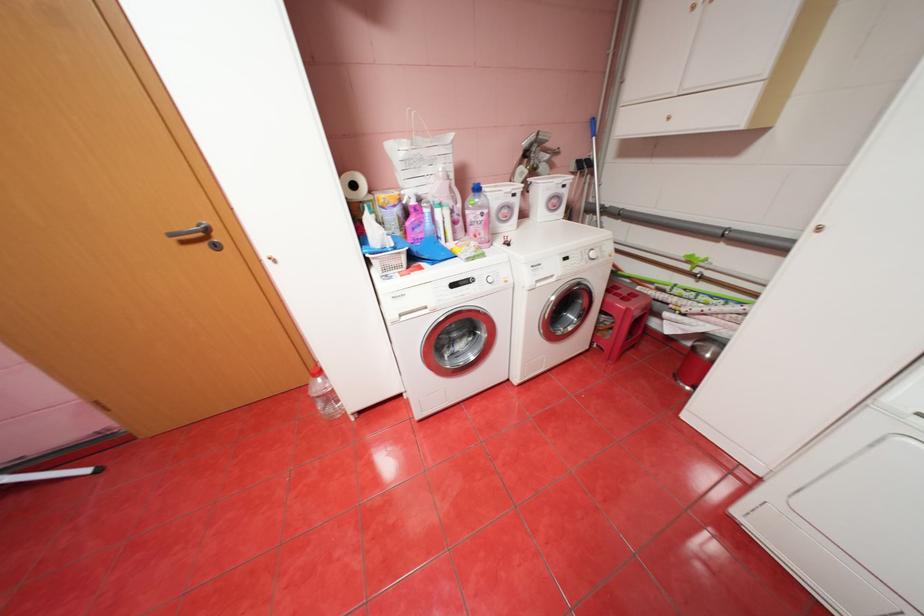
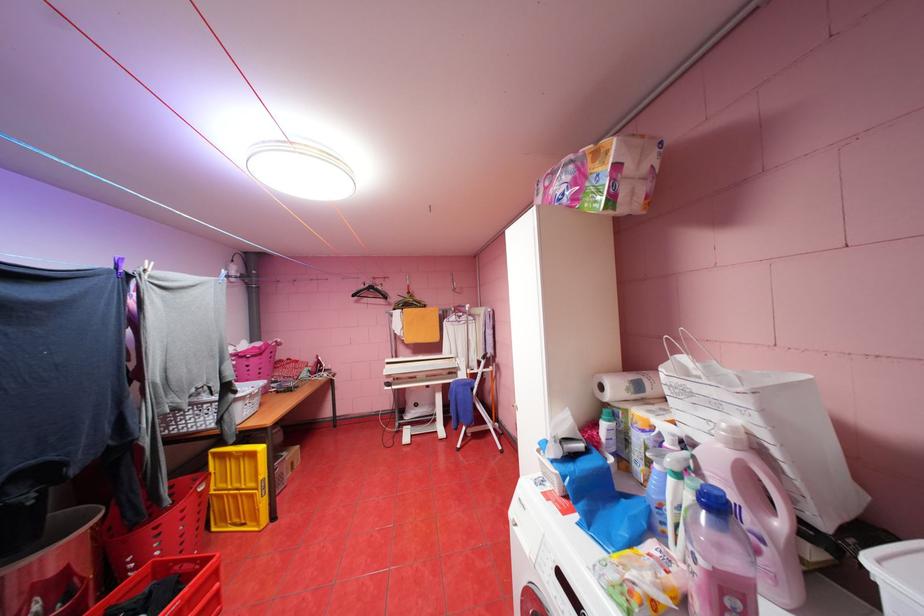
In the second image, find the point that corresponds to (x=362, y=185) in the first image.

(610, 387)